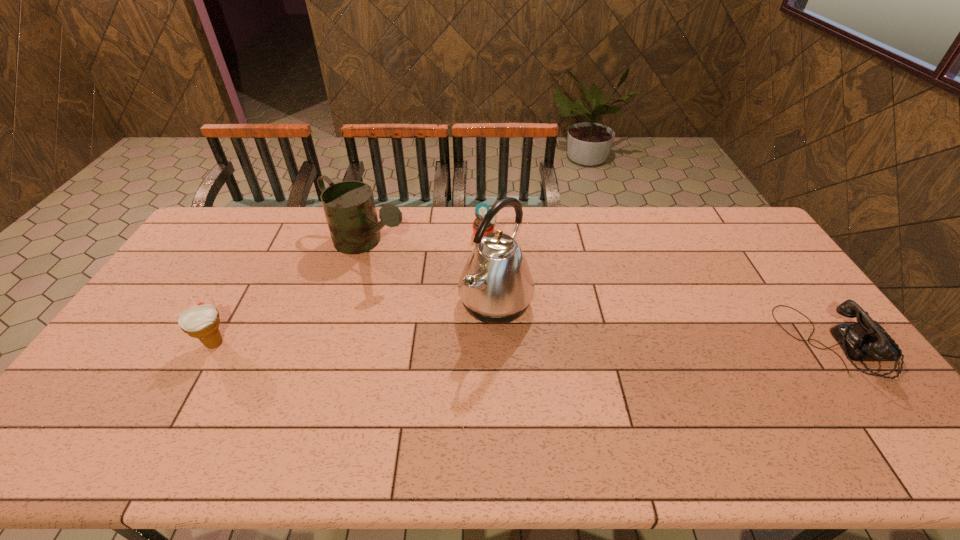
Locate an element on the screen. The height and width of the screenshot is (540, 960). object that is at the right edge is located at coordinates (867, 340).

At what (x,y) coordinates should I click in order to perform the action: click on object at the near right corner. Please return your answer as a coordinate pair (x, y). Looking at the image, I should click on (867, 340).

Find the location of `free point at the far edge`. free point at the far edge is located at coordinates (618, 226).

The width and height of the screenshot is (960, 540). Find the location of `free space at the near edge`. free space at the near edge is located at coordinates (x=715, y=399).

Where is `vacant space at the right edge`? vacant space at the right edge is located at coordinates (792, 311).

The height and width of the screenshot is (540, 960). I want to click on free space between the leftmost object and the telephone, so click(x=526, y=343).

Where is `vacant space in between the rightmost object and the watering can`? vacant space in between the rightmost object and the watering can is located at coordinates (602, 294).

The image size is (960, 540). I want to click on unoccupied area between the telephone and the icecream, so click(x=526, y=343).

Identify the location of vacant area between the muffin and the telephone. (661, 288).

Where is `vacant space that is in between the muffin and the leftmost object`? This screenshot has height=540, width=960. vacant space that is in between the muffin and the leftmost object is located at coordinates (349, 288).